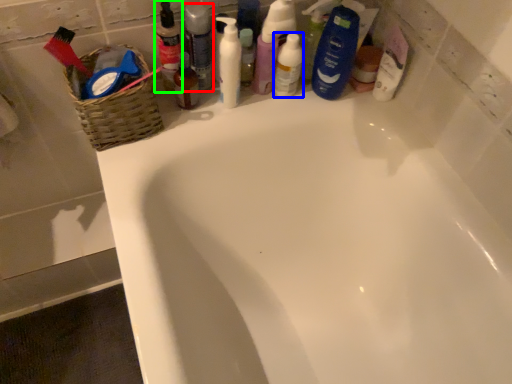
Question: Which is nearer to the toiletry (highlighted by a red box)? mouthwash (highlighted by a blue box) or toiletry (highlighted by a green box).

Choices:
 (A) mouthwash
 (B) toiletry

Answer: (B)